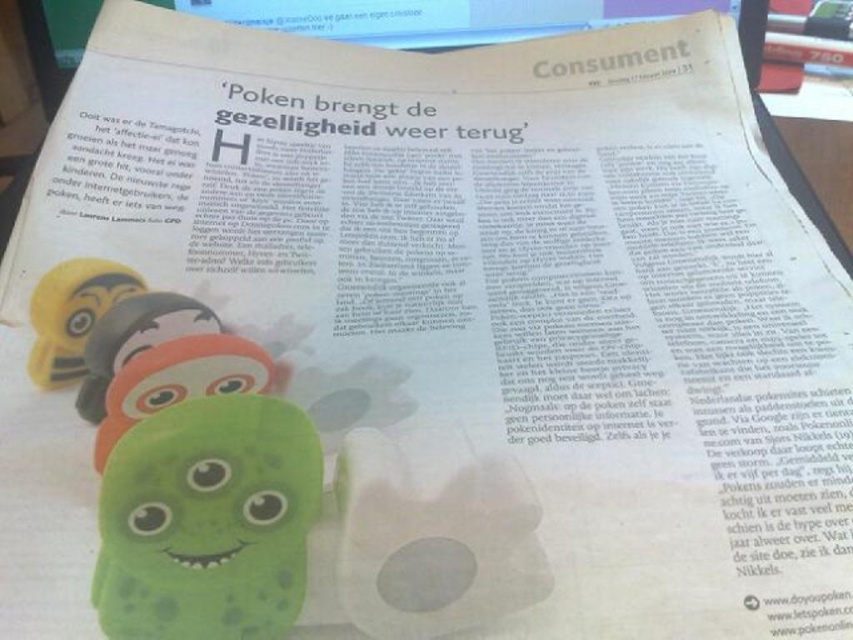
You have two toys in front of you on a newspaper page. The green rubber toy at center and the matte yellow toy at left. Which toy is wider?

The green rubber toy at center is wider than the matte yellow toy at left.

You are organizing a toy store display and need to stack the matte yellow toy at left and the green rubber caterpillar at lower left vertically. Which toy should you place at the bottom to ensure stability?

The matte yellow toy at left should be placed at the bottom because it has a greater height than the green rubber caterpillar at lower left, providing a more stable base for the stack.

Looking at this image, based on the scene description, what are the coordinates of the matte yellow toy at left?

The coordinates of the matte yellow toy at left are at point (73, 314).